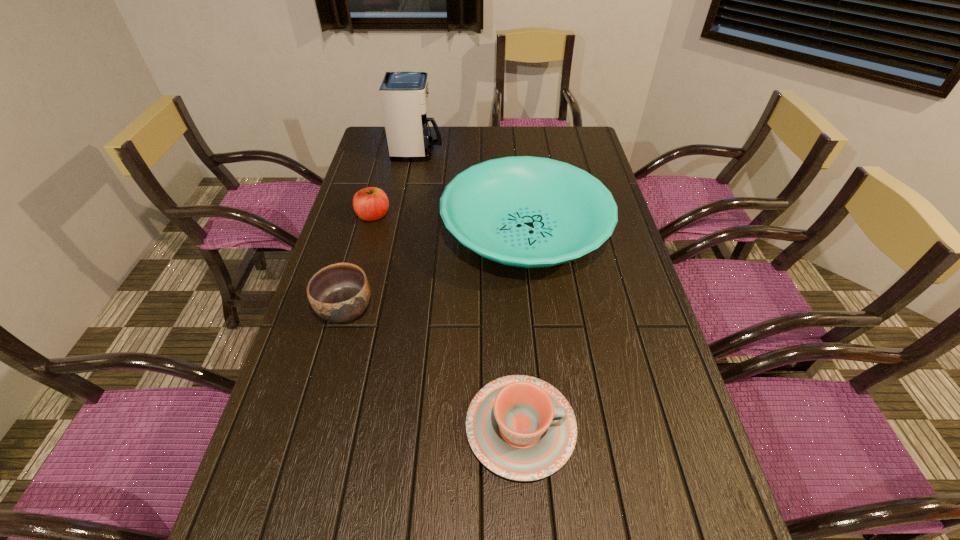
Locate an element on the screen. This screenshot has width=960, height=540. the farthest object is located at coordinates (404, 95).

The height and width of the screenshot is (540, 960). I want to click on the tallest object, so click(404, 95).

You are a GUI agent. You are given a task and a screenshot of the screen. Output one action in this format:
    pyautogui.click(x=<x>, y=<y>)
    Task: Click on the dish
    This screenshot has width=960, height=540.
    Given the screenshot: What is the action you would take?
    pyautogui.click(x=531, y=212)

This screenshot has width=960, height=540. What are the coordinates of `apple` in the screenshot? It's located at (370, 204).

Locate an element on the screen. Image resolution: width=960 pixels, height=540 pixels. bowl is located at coordinates (340, 292).

The image size is (960, 540). I want to click on chinaware, so click(521, 428).

The image size is (960, 540). I want to click on the shortest object, so coord(521,428).

I want to click on vacant area situated 0.070m on the front panel of the farthest object, so click(x=460, y=151).

Identify the location of vacant space located 0.320m on the back of the dish. (515, 140).

Identify the location of vacant space located 0.220m on the right of the apple. Image resolution: width=960 pixels, height=540 pixels. (458, 216).